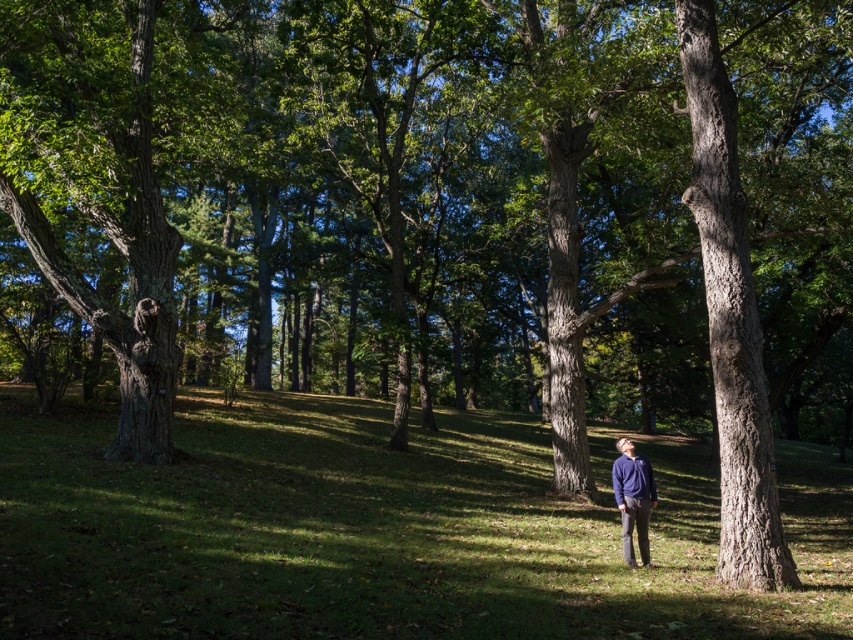
Question: Which of the following is the closest to the observer?

Choices:
 (A) (647, 516)
 (B) (662, 552)

Answer: (A)

Question: Is green grass at center positioned at the back of matte blue sweater at center?

Choices:
 (A) no
 (B) yes

Answer: (A)

Question: Is green grass at center further to the viewer compared to matte blue sweater at center?

Choices:
 (A) yes
 (B) no

Answer: (B)

Question: Is green grass at center to the left of matte blue sweater at center from the viewer's perspective?

Choices:
 (A) no
 (B) yes

Answer: (B)

Question: Which of the following is the farthest from the observer?

Choices:
 (A) matte blue sweater at center
 (B) green grass at center

Answer: (A)